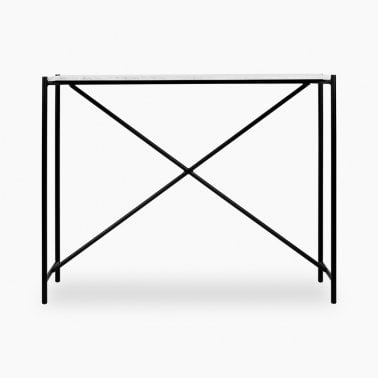
Locate an element on the screen. The width and height of the screenshot is (378, 378). console table is located at coordinates (243, 81).